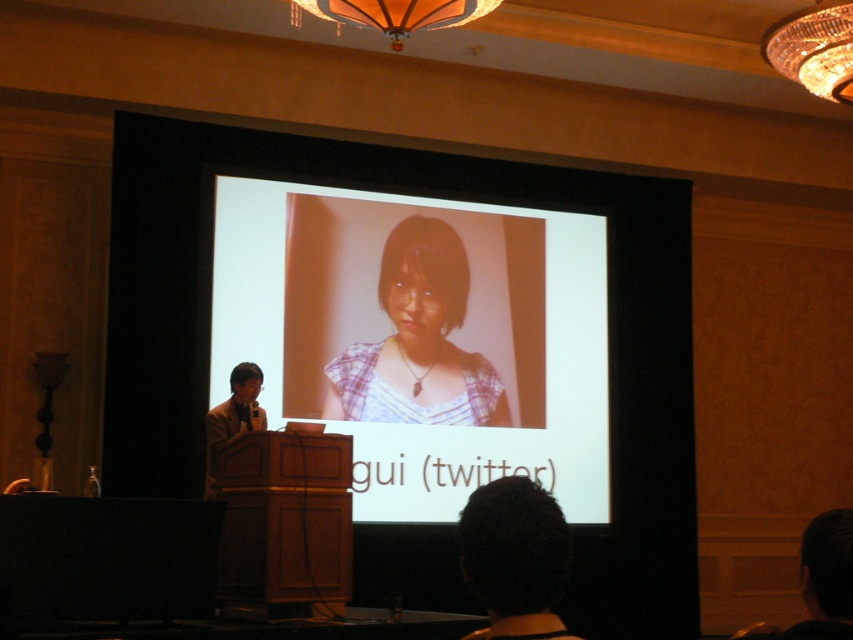
Based on the scene description, what object is located at the coordinates point (421, 337)?

The point (421, 337) indicates the white glossy projection screen at center.

You are sitting in the audience and want to see both the white glossy projection screen at center and the plaid fabric at center. Which one is closer to you?

The white glossy projection screen at center is closer to you because it is in front of the plaid fabric at center.